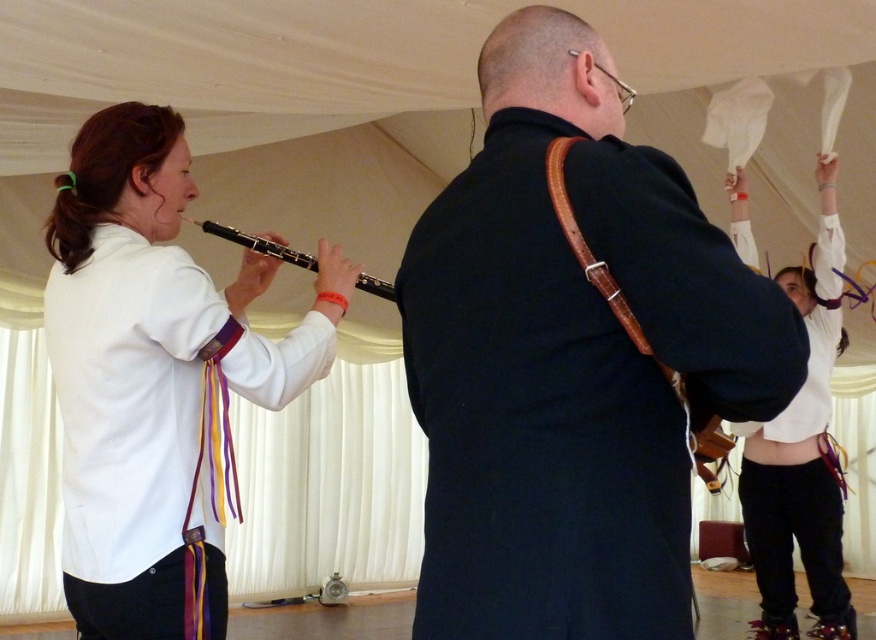
From the picture: Who is taller, white matte flute at left or black wood flute at left?

white matte flute at left

Can you confirm if white matte flute at left is positioned to the right of black wood flute at left?

In fact, white matte flute at left is to the left of black wood flute at left.

You are a GUI agent. You are given a task and a screenshot of the screen. Output one action in this format:
    pyautogui.click(x=<x>, y=<y>)
    Task: Click on the white matte flute at left
    
    Given the screenshot: What is the action you would take?
    pyautogui.click(x=150, y=364)

Does dark blue jacket at center have a greater height compared to white matte pants at lower right?

Incorrect, dark blue jacket at center's height is not larger of white matte pants at lower right's.

Is dark blue jacket at center in front of white matte pants at lower right?

That is True.

This screenshot has width=876, height=640. Find the location of `dark blue jacket at center`. dark blue jacket at center is located at coordinates (571, 358).

Is dark blue jacket at center positioned at the back of white matte flute at left?

No.

Who is more forward, (676, 449) or (108, 461)?

Point (676, 449) is in front.

Locate an element on the screen. dark blue jacket at center is located at coordinates (571, 358).